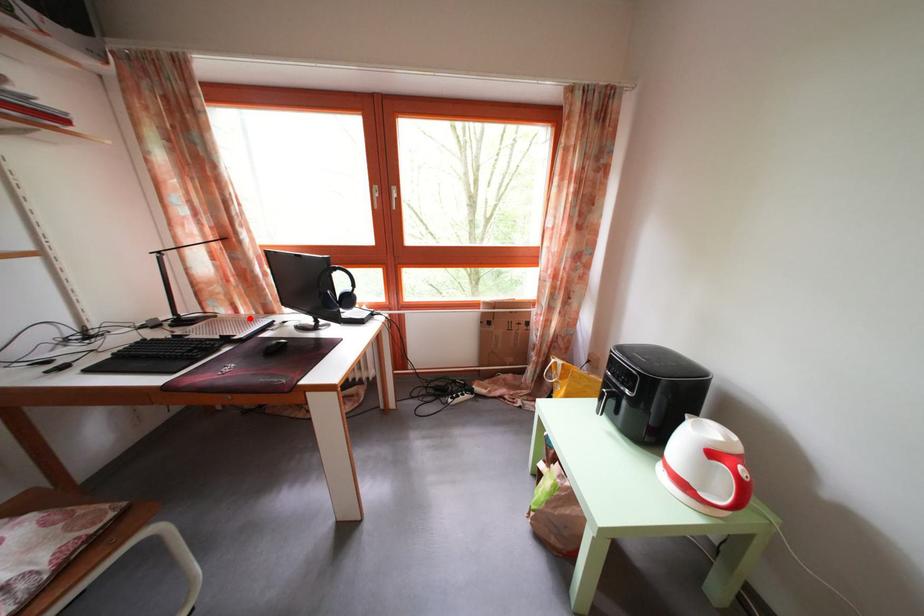
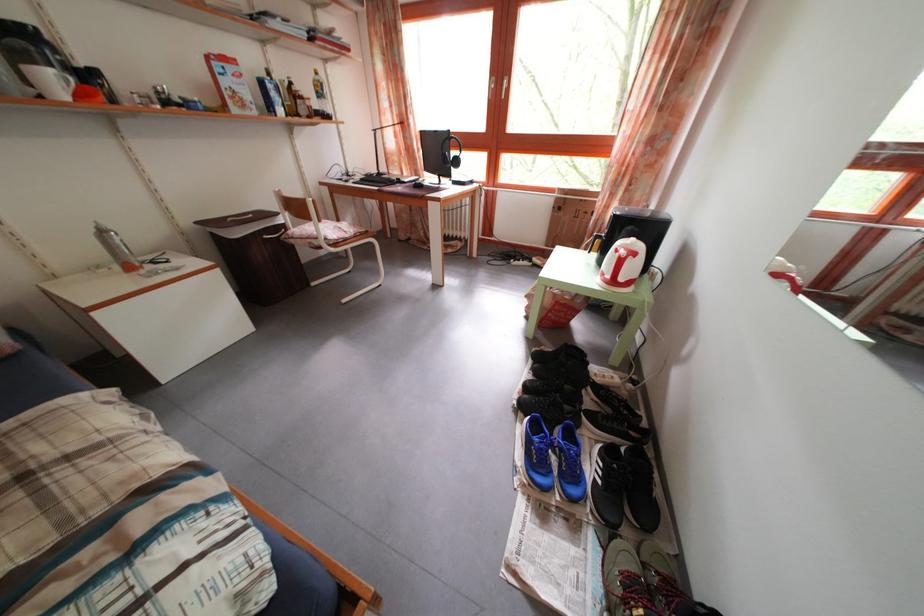
Find the pixel in the second image that matches the highlighted location in the first image.

(412, 182)